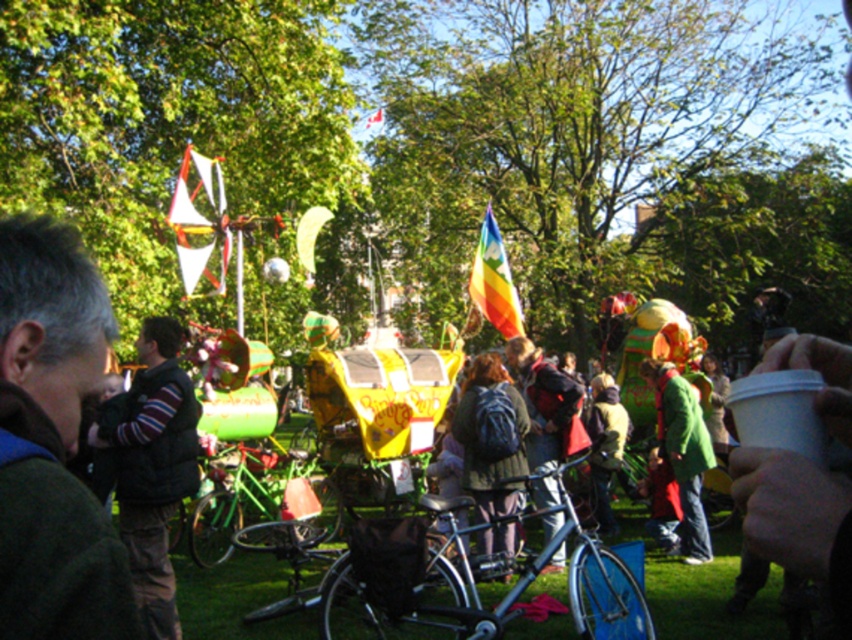
Question: Is green fabric jacket at left below rainbow fabric flag at center?

Choices:
 (A) yes
 (B) no

Answer: (A)

Question: Which point is farther to the camera?

Choices:
 (A) [216, 493]
 (B) [440, 500]

Answer: (A)

Question: In this image, where is green grass at lower center located relative to rainbow fabric flag at center?

Choices:
 (A) right
 (B) left

Answer: (A)

Question: Among these points, which one is farthest from the camera?

Choices:
 (A) (220, 522)
 (B) (501, 465)

Answer: (A)

Question: Can you confirm if green fabric jacket at left is smaller than shiny metallic bicycle at center?

Choices:
 (A) yes
 (B) no

Answer: (A)

Question: Among these objects, which one is nearest to the camera?

Choices:
 (A) rainbow fabric flag at center
 (B) shiny metallic bicycle at center
 (C) white fabric flag at upper left

Answer: (B)